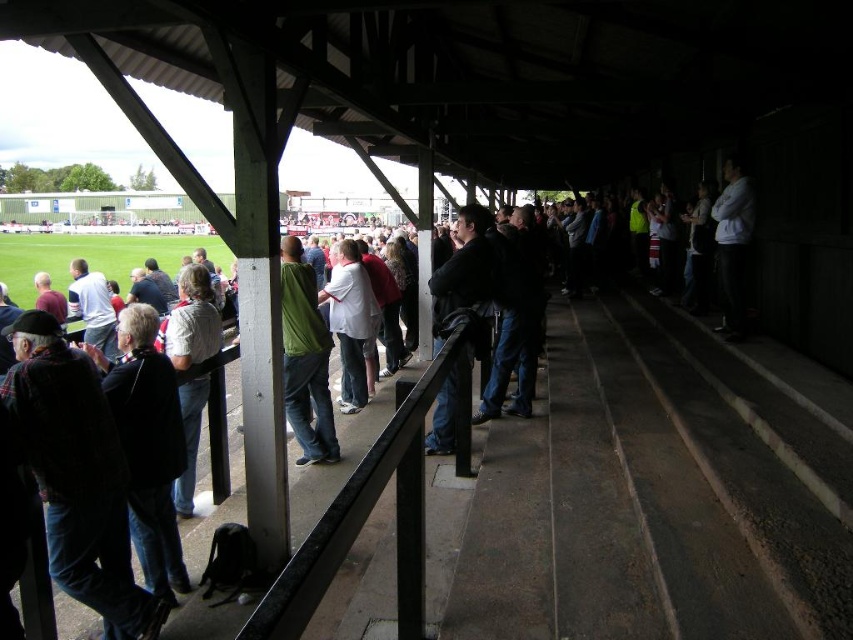
Question: In this image, where is light gray shirt at center located relative to white matte jacket at upper right?

Choices:
 (A) left
 (B) right

Answer: (A)

Question: In this image, where is dark plaid sweater at left located relative to green matte shirt at center?

Choices:
 (A) above
 (B) below

Answer: (B)

Question: Can you confirm if green matte shirt at center is positioned above black leather jacket at center?

Choices:
 (A) no
 (B) yes

Answer: (A)

Question: Which point is closer to the camera taking this photo?

Choices:
 (A) (480, 268)
 (B) (722, 316)
 (C) (328, 284)

Answer: (A)

Question: Which of the following is the farthest from the observer?

Choices:
 (A) (486, 244)
 (B) (100, 605)
 (C) (734, 250)
 (D) (297, 285)

Answer: (C)

Question: Which point is closer to the camera taking this photo?

Choices:
 (A) pyautogui.click(x=733, y=227)
 (B) pyautogui.click(x=170, y=339)
 (C) pyautogui.click(x=347, y=332)
 (D) pyautogui.click(x=109, y=499)

Answer: (D)